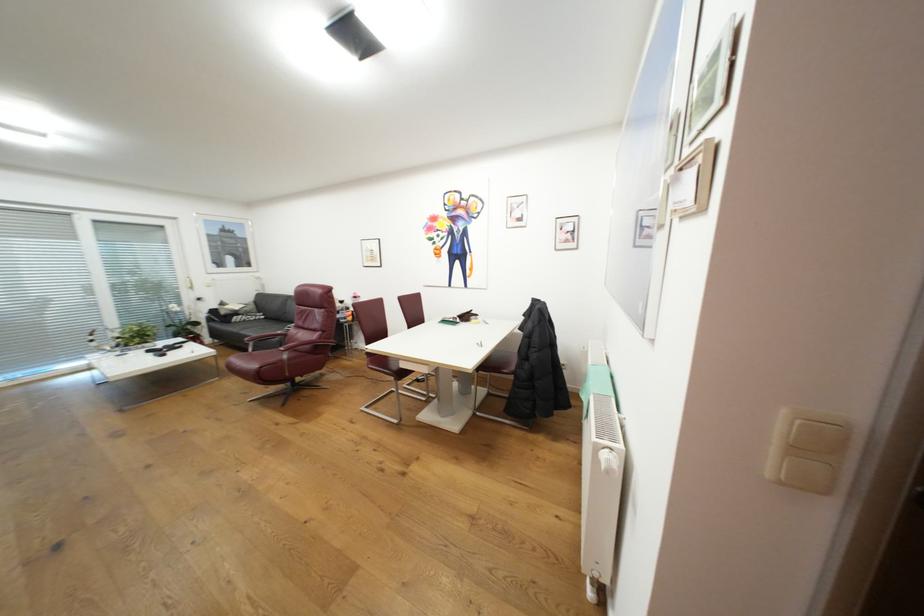
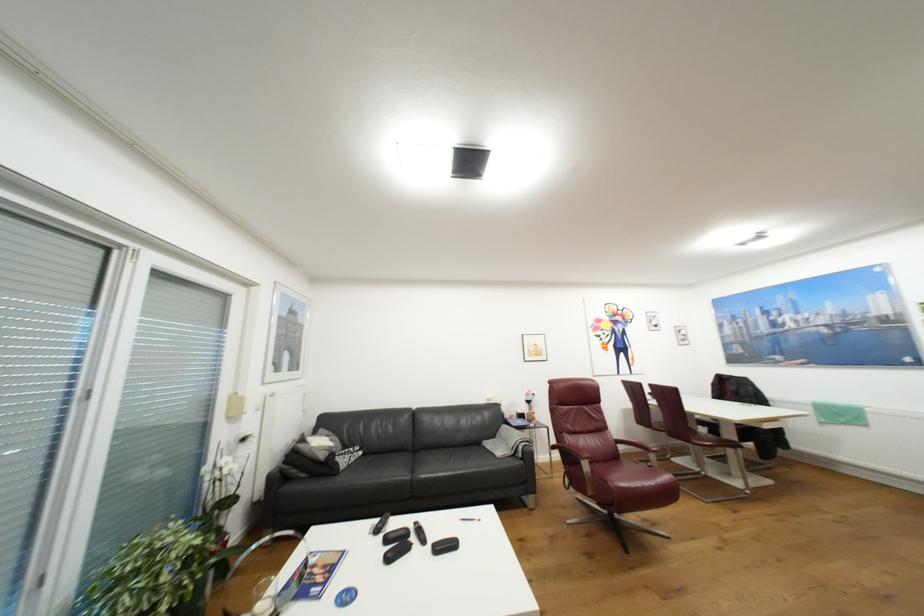
The point at (229, 304) is marked in the first image. Where is the corresponding point in the second image?

(309, 440)